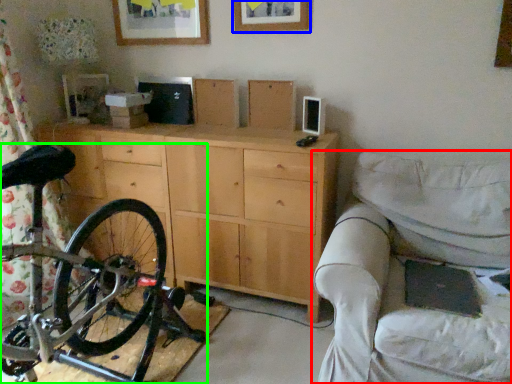
Question: Which is farther away from studio couch (highlighted by a red box)? picture frame (highlighted by a blue box) or bicycle (highlighted by a green box)?

Choices:
 (A) picture frame
 (B) bicycle

Answer: (A)